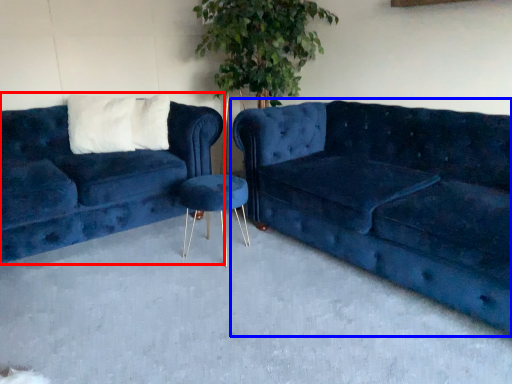
Question: Which point is closer to the camera, studio couch (highlighted by a red box) or studio couch (highlighted by a blue box)?

Choices:
 (A) studio couch
 (B) studio couch

Answer: (B)